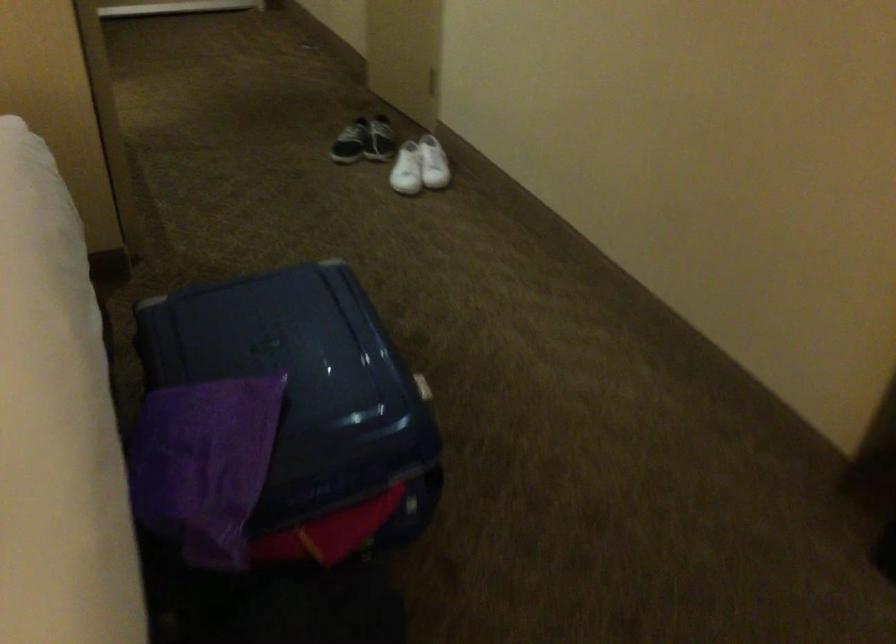
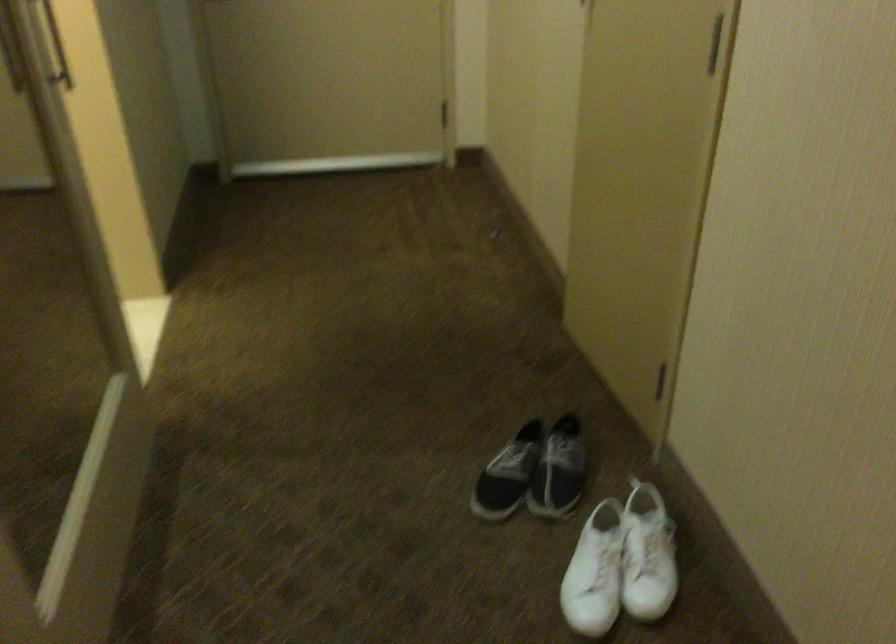
Question: What movement of the cameraman would produce the second image?

Choices:
 (A) Left
 (B) Right
 (C) Forward
 (D) Backward

Answer: (C)